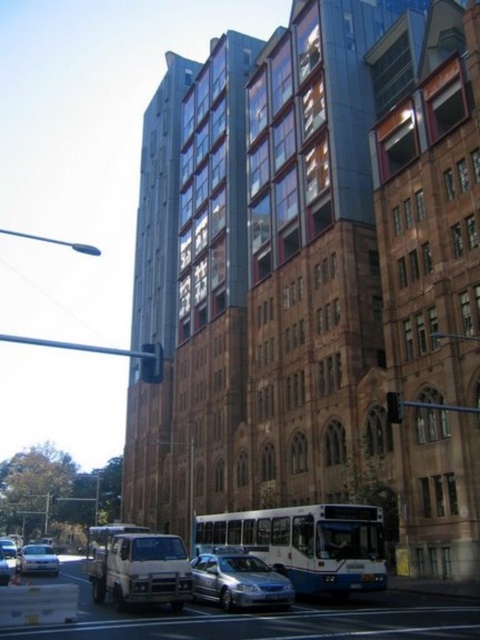
Question: Which of the following is the farthest from the observer?

Choices:
 (A) (396, 413)
 (B) (1, 563)
 (C) (31, 560)
 (D) (144, 374)

Answer: (C)

Question: Is white matte bus at center to the left of black plastic traffic light at center from the viewer's perspective?

Choices:
 (A) yes
 (B) no

Answer: (B)

Question: Among these objects, which one is farthest from the camera?

Choices:
 (A) matte white bus at center
 (B) silver metallic sedan at center
 (C) white matte bus at center

Answer: (B)

Question: Can you confirm if matte white bus at center is smaller than metallic at right?

Choices:
 (A) no
 (B) yes

Answer: (A)

Question: Does matte white bus at center appear over silver metallic sedan at center?

Choices:
 (A) no
 (B) yes

Answer: (A)

Question: Which of these objects is positioned closest to the black plastic traffic light at center?

Choices:
 (A) metallic at right
 (B) silver metallic sedan at lower left

Answer: (A)